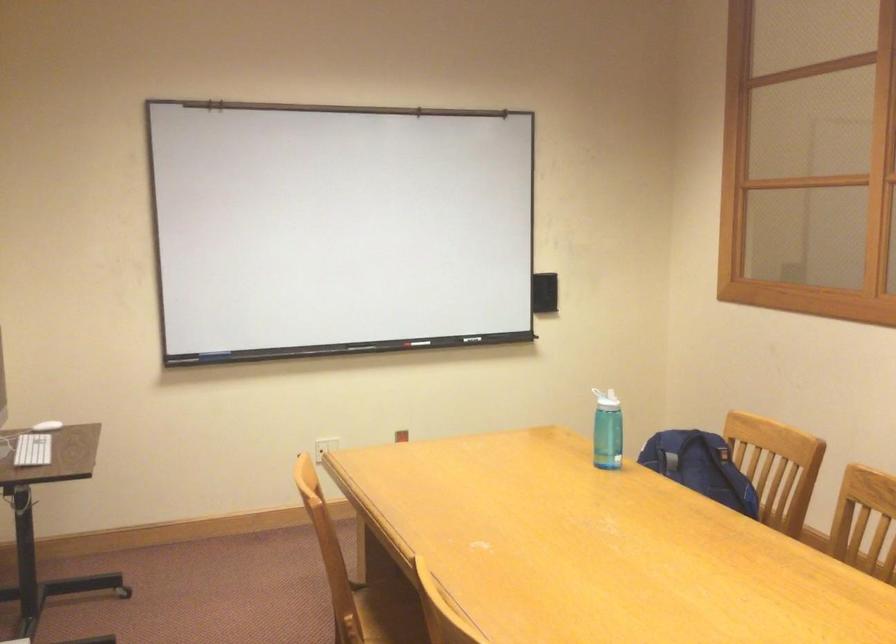
What do you see at coordinates (390, 623) in the screenshot? This screenshot has width=896, height=644. I see `a wooden chair sitting surface` at bounding box center [390, 623].